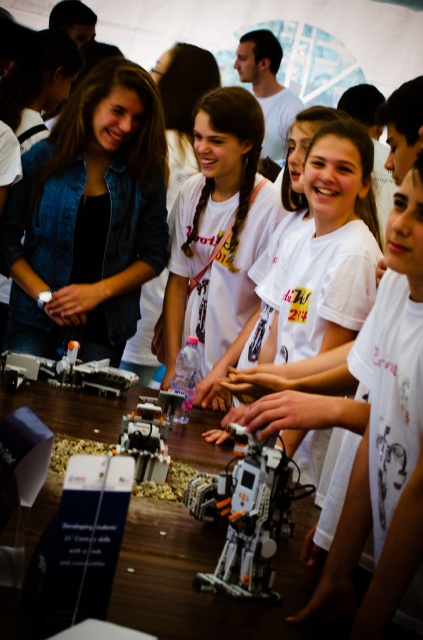
Question: Considering the real-world distances, which object is closest to the white matte hand at center?

Choices:
 (A) smooth skin hand at center
 (B) denim jacket at upper left

Answer: (A)

Question: Which object appears closest to the camera in this image?

Choices:
 (A) smooth skin hand at center
 (B) matte white hand at center
 (C) white matte hand at center
 (D) wooden table at center

Answer: (D)

Question: Does denim jacket at upper left appear over white matte hand at center?

Choices:
 (A) no
 (B) yes

Answer: (B)

Question: Estimate the real-world distances between objects in this image. Which object is farther from the wooden table at center?

Choices:
 (A) matte white hand at center
 (B) matte black hand at center
 (C) white matte hand at center

Answer: (B)

Question: Observing the image, what is the correct spatial positioning of denim jacket at upper left in reference to matte white hand at center?

Choices:
 (A) above
 (B) below

Answer: (A)

Question: Does smooth white hand at center appear over matte black hand at center?

Choices:
 (A) yes
 (B) no

Answer: (B)